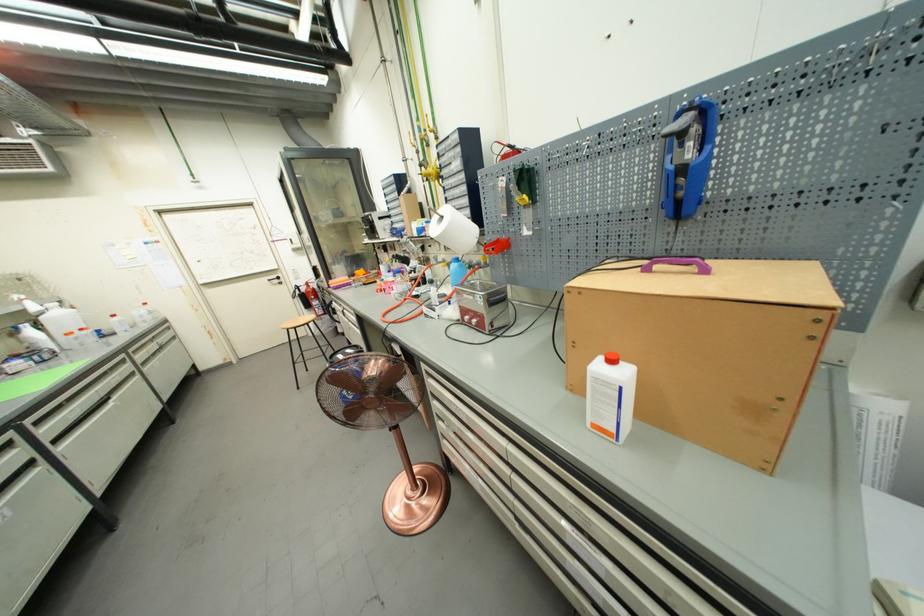
The image size is (924, 616). What do you see at coordinates (687, 156) in the screenshot?
I see `the spray bottle trigger` at bounding box center [687, 156].